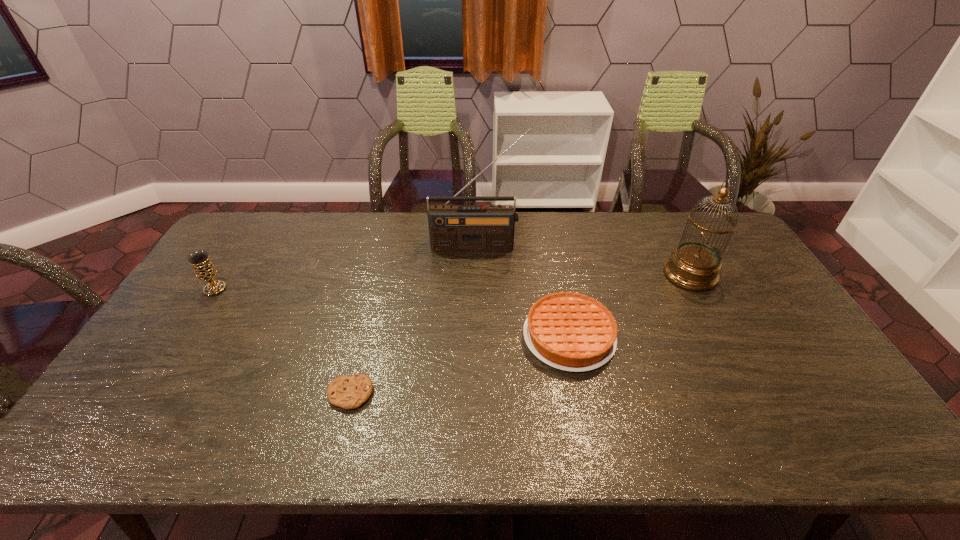
Locate an element on the screen. The width and height of the screenshot is (960, 540). radio receiver is located at coordinates (490, 228).

Find the location of `the farthest object`. the farthest object is located at coordinates (490, 228).

Find the location of a particular element. the fourth shortest object is located at coordinates (693, 265).

Locate an element on the screen. birdcage is located at coordinates (693, 265).

At what (x,y) coordinates should I click in order to perform the action: click on the third tallest object. Please return your answer as a coordinate pair (x, y). Looking at the image, I should click on (205, 271).

Image resolution: width=960 pixels, height=540 pixels. What are the coordinates of `the leftmost object` in the screenshot? It's located at (205, 271).

I want to click on the second nearest object, so click(569, 331).

Find the location of `pie`. pie is located at coordinates (569, 331).

Locate an element on the screen. This screenshot has height=540, width=960. the nearest object is located at coordinates (348, 392).

This screenshot has height=540, width=960. In order to click on the second object from left to right in this screenshot , I will do `click(348, 392)`.